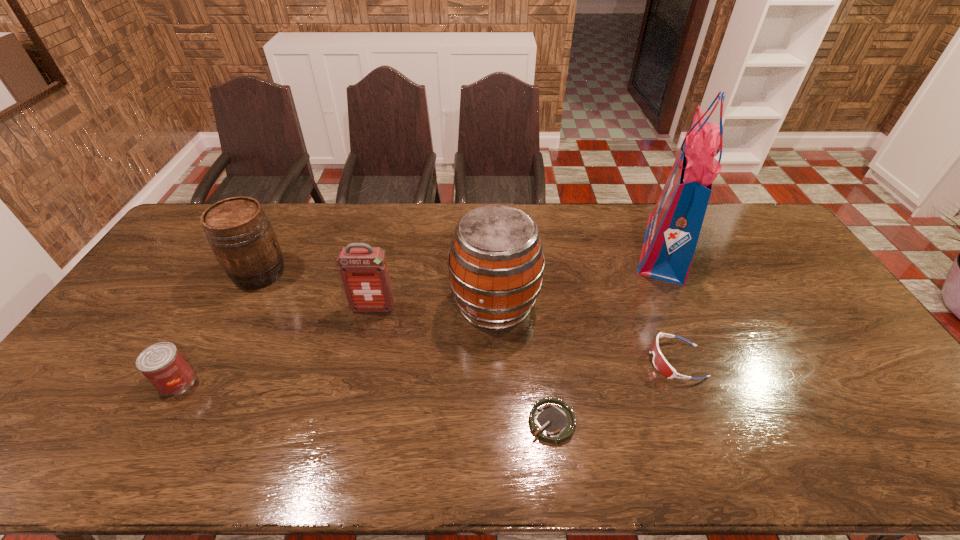
The width and height of the screenshot is (960, 540). What are the coordinates of `the tallest object` in the screenshot? It's located at (674, 225).

At what (x,y) coordinates should I click in order to perform the action: click on the right cider. Please return your answer as a coordinate pair (x, y). The image size is (960, 540). Looking at the image, I should click on (496, 261).

You are a GUI agent. You are given a task and a screenshot of the screen. Output one action in this format:
    pyautogui.click(x=<x>, y=<y>)
    Task: Click on the second tallest object
    This screenshot has height=540, width=960.
    Given the screenshot: What is the action you would take?
    pyautogui.click(x=496, y=261)

Where is `the third object from left to right`? the third object from left to right is located at coordinates (363, 269).

In order to click on the left cider in this screenshot , I will do pyautogui.click(x=239, y=232).

Find the location of a particular element. Image resolution: width=960 pixels, height=540 pixels. the third shortest object is located at coordinates (162, 364).

This screenshot has width=960, height=540. What are the coordinates of `goggles` in the screenshot? It's located at (660, 363).

The width and height of the screenshot is (960, 540). In order to click on the shortest object in this screenshot , I will do `click(551, 420)`.

Find the location of a particular element. The height and width of the screenshot is (540, 960). the nearest object is located at coordinates coord(551,420).

The height and width of the screenshot is (540, 960). Find the location of `vacant region located 0.380m on the front-facing side of the tallest object`. vacant region located 0.380m on the front-facing side of the tallest object is located at coordinates (517, 246).